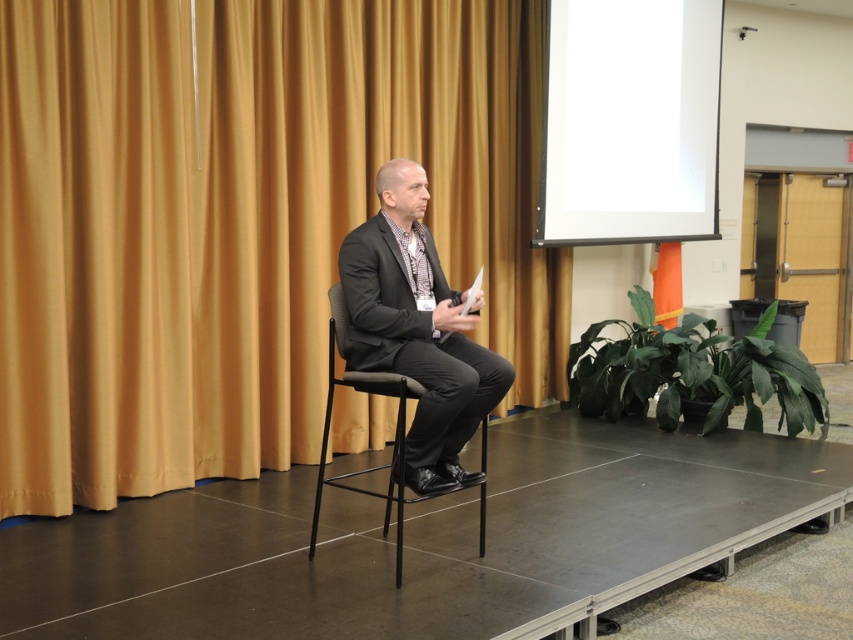
Is point (396, 218) positioned before point (325, 419)?

Yes, point (396, 218) is closer to viewer.

Who is positioned more to the left, matte black suit at center or black mesh chair at center?

black mesh chair at center is more to the left.

Who is more distant from viewer, (408, 432) or (396, 531)?

The point (396, 531) is behind.

The image size is (853, 640). I want to click on matte black suit at center, so click(x=416, y=328).

Does white glossy projection screen at upper right appear over matte black suit at center?

Correct, white glossy projection screen at upper right is located above matte black suit at center.

Who is positioned more to the left, white glossy projection screen at upper right or matte black suit at center?

matte black suit at center is more to the left.

Find the location of `white glossy projection screen at upper right`. white glossy projection screen at upper right is located at coordinates (630, 122).

Who is higher up, white glossy projection screen at upper right or black mesh chair at center?

Positioned higher is white glossy projection screen at upper right.

Does white glossy projection screen at upper right appear on the right side of black mesh chair at center?

Indeed, white glossy projection screen at upper right is positioned on the right side of black mesh chair at center.

Where is `white glossy projection screen at upper right`? Image resolution: width=853 pixels, height=640 pixels. white glossy projection screen at upper right is located at coordinates (630, 122).